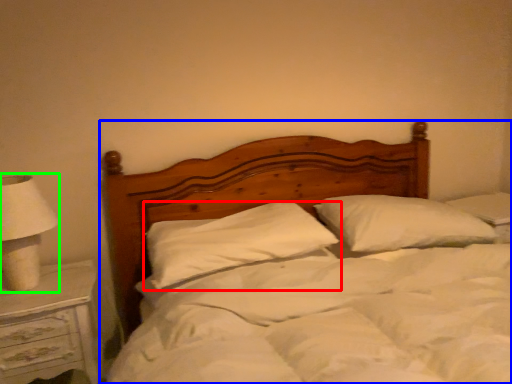
Question: Considering the real-world distances, which object is closest to pillow (highlighted by a red box)? bed (highlighted by a blue box) or lamp (highlighted by a green box).

Choices:
 (A) bed
 (B) lamp

Answer: (A)